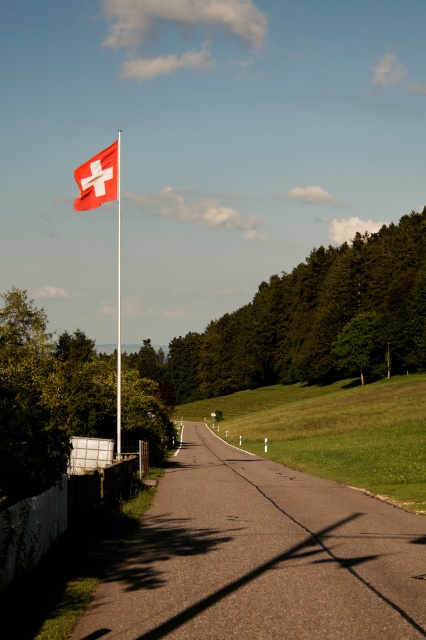
Can you confirm if asphalt road at center is bigger than red plastic flag pole at upper left?

No, asphalt road at center is not bigger than red plastic flag pole at upper left.

In order to click on asphalt road at center in this screenshot , I will do `click(261, 556)`.

Is red fabric flag at upper left positioned behind red plastic flag pole at upper left?

That is True.

Which is above, red fabric flag at upper left or red plastic flag pole at upper left?

red fabric flag at upper left

Does point (112, 168) come in front of point (120, 368)?

Yes, point (112, 168) is closer to viewer.

In order to click on red fabric flag at upper left in this screenshot , I will do `click(97, 179)`.

Does asphalt road at center have a smaller size compared to red fabric flag at upper left?

Correct, asphalt road at center occupies less space than red fabric flag at upper left.

Is asphalt road at center below red fabric flag at upper left?

Yes.

Does point (221, 624) come behind point (88, 173)?

No, (221, 624) is in front of (88, 173).

Where is `asphalt road at center`? The width and height of the screenshot is (426, 640). asphalt road at center is located at coordinates (261, 556).